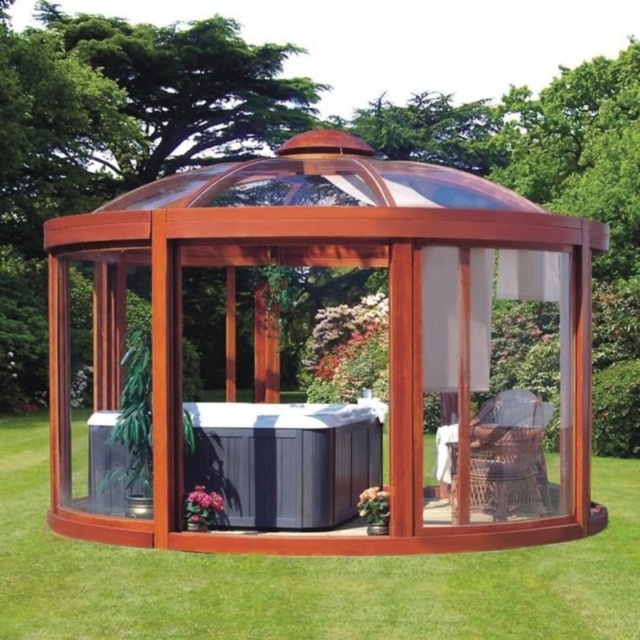
Question: Is wooden gazebo at center positioned in front of green grass at center?

Choices:
 (A) yes
 (B) no

Answer: (B)

Question: Can you confirm if wooden gazebo at center is wider than green grass at center?

Choices:
 (A) no
 (B) yes

Answer: (A)

Question: Is wooden gazebo at center to the right of green grass at center from the viewer's perspective?

Choices:
 (A) yes
 (B) no

Answer: (B)

Question: Which of the following is the farthest from the observer?

Choices:
 (A) (288, 170)
 (B) (108, 616)

Answer: (A)

Question: Which of the following is the closest to the observer?

Choices:
 (A) click(16, 492)
 (B) click(502, 227)

Answer: (B)